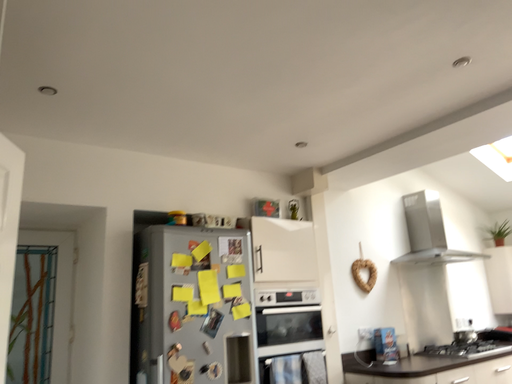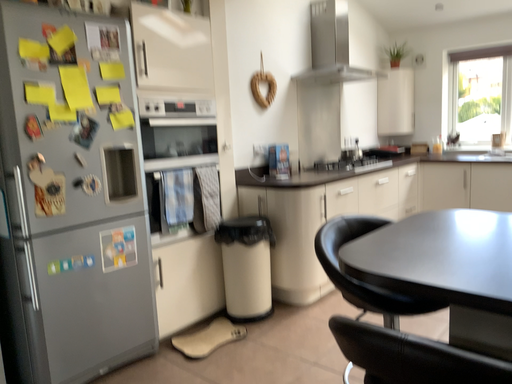
Question: Which way did the camera rotate in the video?

Choices:
 (A) rotated upward
 (B) rotated downward

Answer: (B)